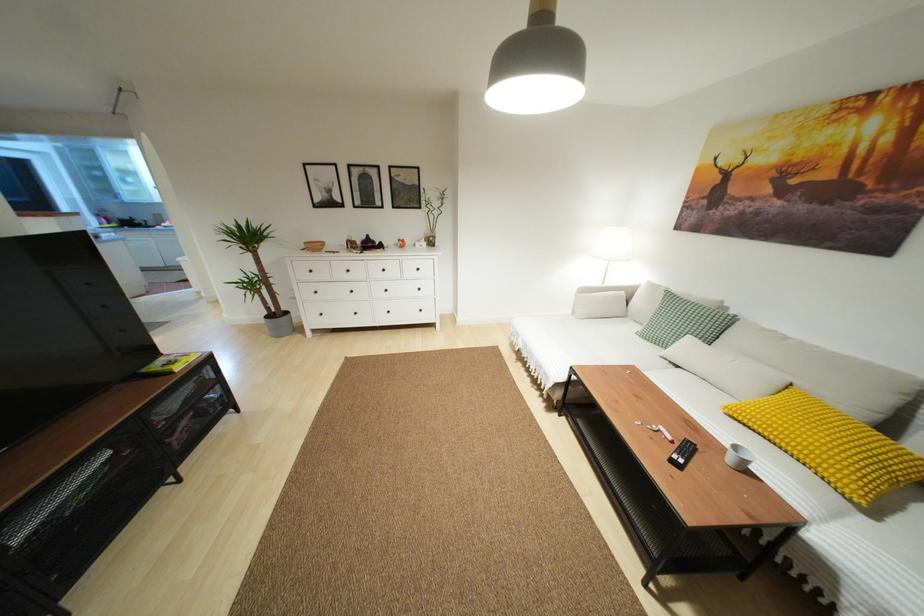
What do you see at coordinates (737, 456) in the screenshot?
I see `the white mug` at bounding box center [737, 456].